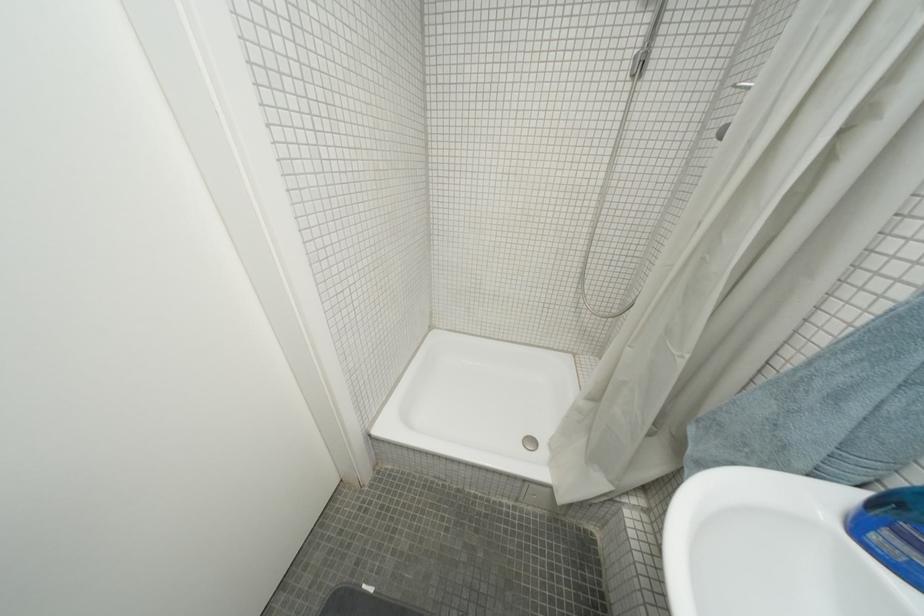
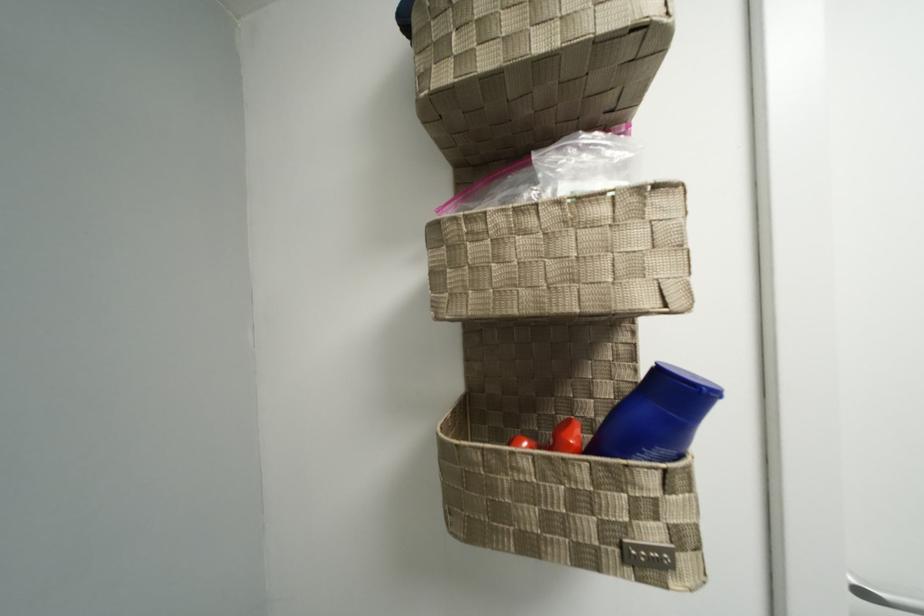
Question: How did the camera likely rotate?

Choices:
 (A) Left
 (B) Right
 (C) Up
 (D) Down

Answer: (A)